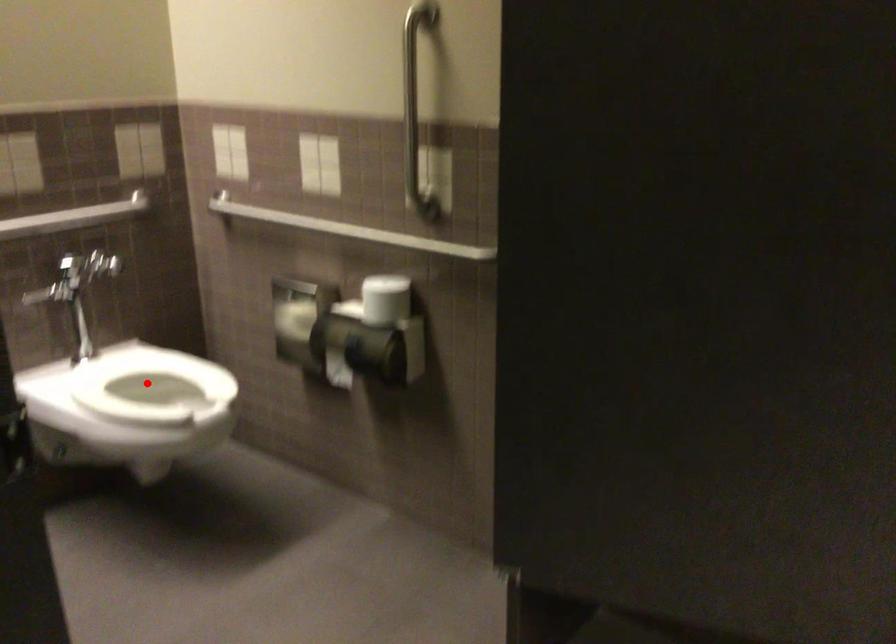
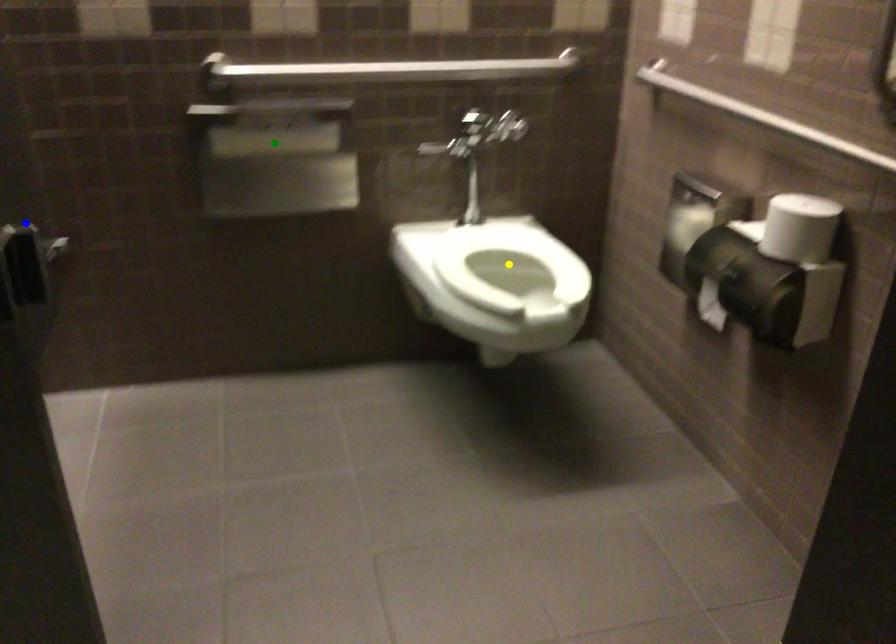
Question: I am providing you with two images of the same scene from different viewpoints. A red point is marked on the first image. You are given multiple points on the second image. In image 2, which mark is for the same physical point as the one in image 1?

Choices:
 (A) green point
 (B) blue point
 (C) yellow point

Answer: (C)